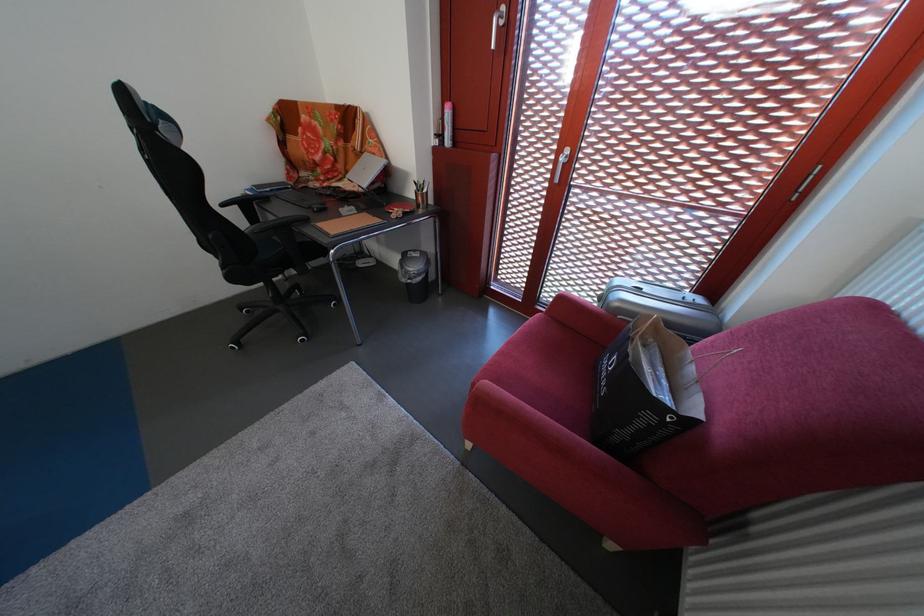
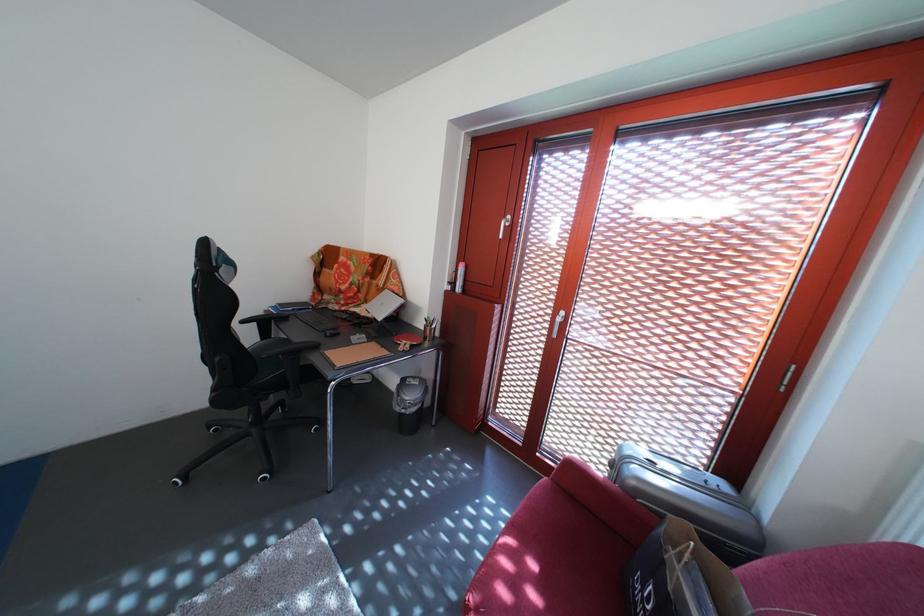
Where in the second image is the point corresponding to point 574,305 from the first image?

(584, 475)